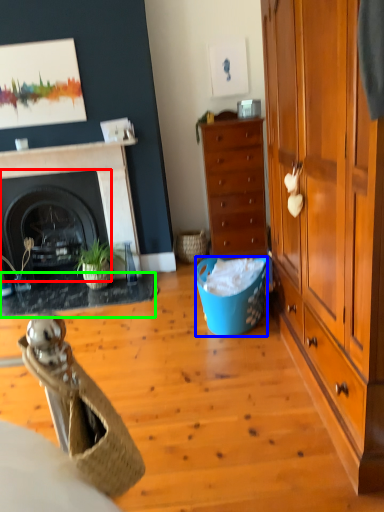
Question: Considering the real-world distances, which object is farthest from fireplace (highlighted by a red box)? trash bin/can (highlighted by a blue box) or carpets (highlighted by a green box)?

Choices:
 (A) trash bin/can
 (B) carpets

Answer: (A)